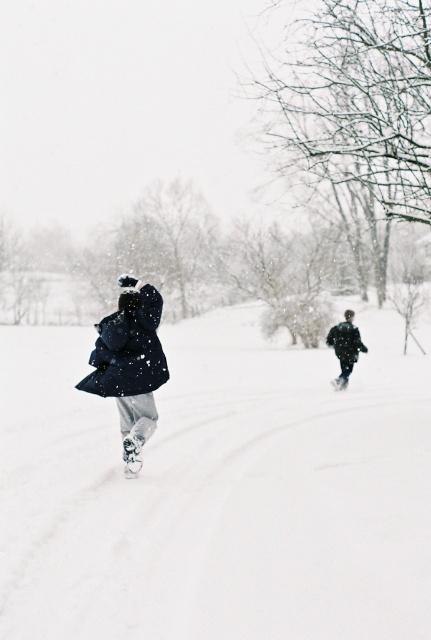
You are standing in the winter scene and want to walk towards the matte black coat at left. Which direction should you move relative to the white fluffy snow at center?

You should move to the right relative to the white fluffy snow at center because the matte black coat at left is positioned on the left side of the white fluffy snow at center, meaning the snow is to your left and the coat is further to the left. Wait, this seems contradictory. Let me think again. If the snow is at the center and the coat is on the left side of the snow, then to reach the coat from the snow, you would move left. But the question says you are standing in the scene and want to walk towards...

You are standing at the origin point of the coordinate system. You want to walk to the white fluffy snow at center. Which direction should you move in?

The white fluffy snow at center is located at coordinate point 0.766 on the x axis and 0.506 on the y axis. Therefore, you should move in the positive x direction and slightly positive y direction to reach it.